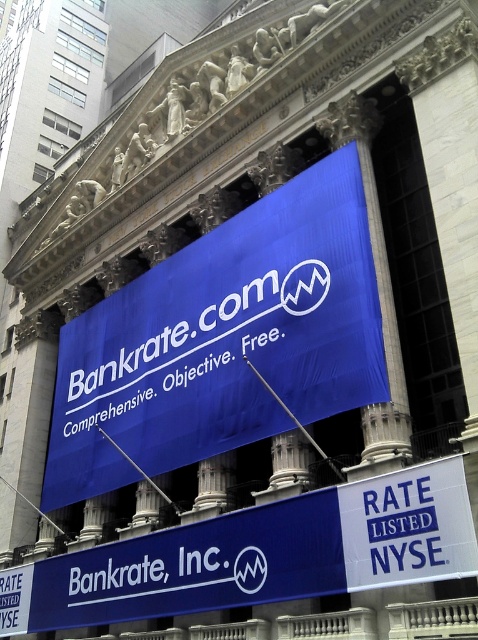
Question: Can you confirm if blue fabric banner at center is positioned below blue matte banner at center?

Choices:
 (A) no
 (B) yes

Answer: (A)

Question: Among these objects, which one is farthest from the camera?

Choices:
 (A) blue matte banner at center
 (B) blue fabric banner at center

Answer: (B)

Question: Which point is closer to the camera?

Choices:
 (A) click(111, 464)
 (B) click(235, 570)

Answer: (B)

Question: Can you confirm if blue fabric banner at center is positioned below blue matte banner at center?

Choices:
 (A) yes
 (B) no

Answer: (B)

Question: Is blue fabric banner at center smaller than blue matte banner at center?

Choices:
 (A) no
 (B) yes

Answer: (A)